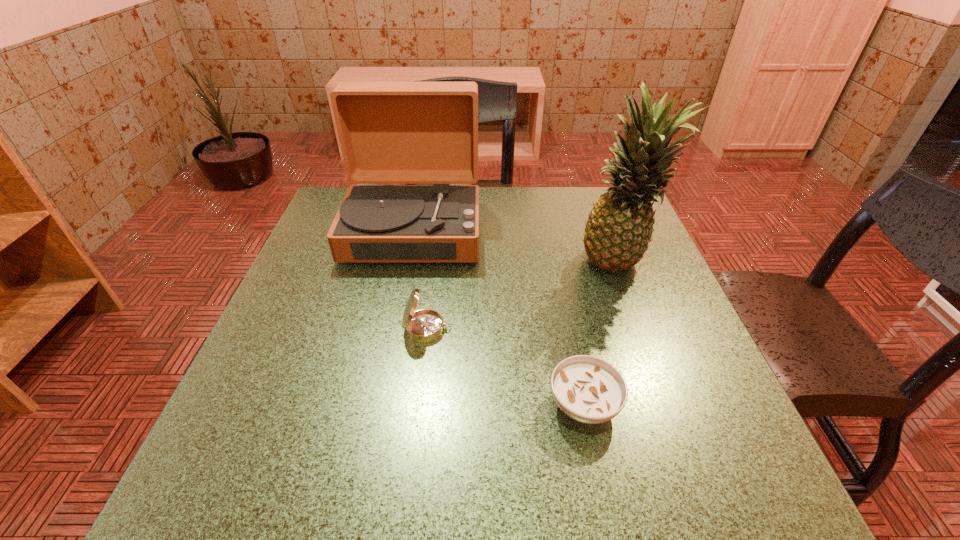
Locate which object ranks third in proximity to the third farthest object. Please provide its 2D coordinates. Your answer should be formatted as a tuple, i.e. [(x, y)], where the tuple contains the x and y coordinates of a point satisfying the conditions above.

[(619, 227)]

I want to click on vacant area that satisfies the following two spatial constraints: 1. on the face of the third shortest object; 2. on the right side of the shortest object, so click(378, 405).

Identify the location of vacant area in the image that satisfies the following two spatial constraints: 1. on the back side of the nearest object; 2. with the dial facing the third tallest object. (568, 328).

You are a GUI agent. You are given a task and a screenshot of the screen. Output one action in this format:
    pyautogui.click(x=<x>, y=<y>)
    Task: Click on the free space that satisfies the following two spatial constraints: 1. on the front side of the pineapple; 2. with the dial facing the third farthest object
    This screenshot has height=540, width=960.
    Given the screenshot: What is the action you would take?
    pyautogui.click(x=643, y=328)

Identify the location of vacant space that satisfies the following two spatial constraints: 1. with the dial facing the soup bowl; 2. on the right side of the second nearest object. (418, 405).